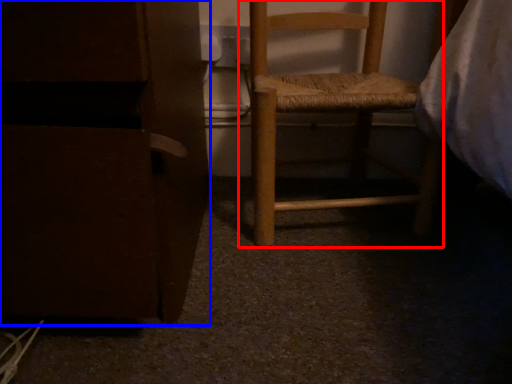
Question: Which object appears farthest to the camera in this image, furniture (highlighted by a red box) or furniture (highlighted by a blue box)?

Choices:
 (A) furniture
 (B) furniture

Answer: (A)